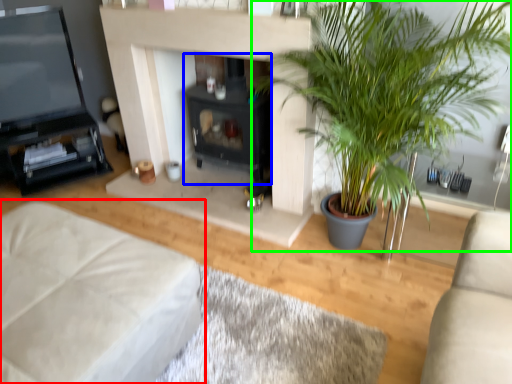
Question: Which object is the closest to the studio couch (highlighted by a red box)? Choose among these: fireplace (highlighted by a blue box) or houseplant (highlighted by a green box).

Choices:
 (A) fireplace
 (B) houseplant

Answer: (B)